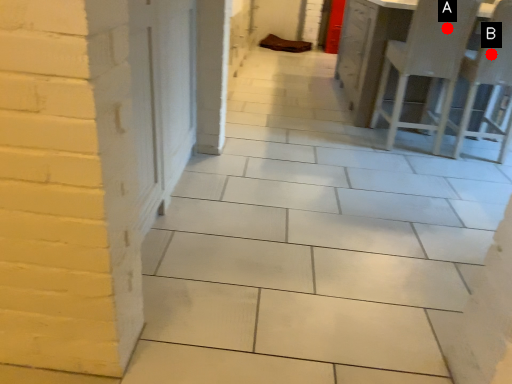
Question: Two points are circled on the image, labeled by A and B beside each circle. Which point is closer to the camera?

Choices:
 (A) A is closer
 (B) B is closer

Answer: (A)